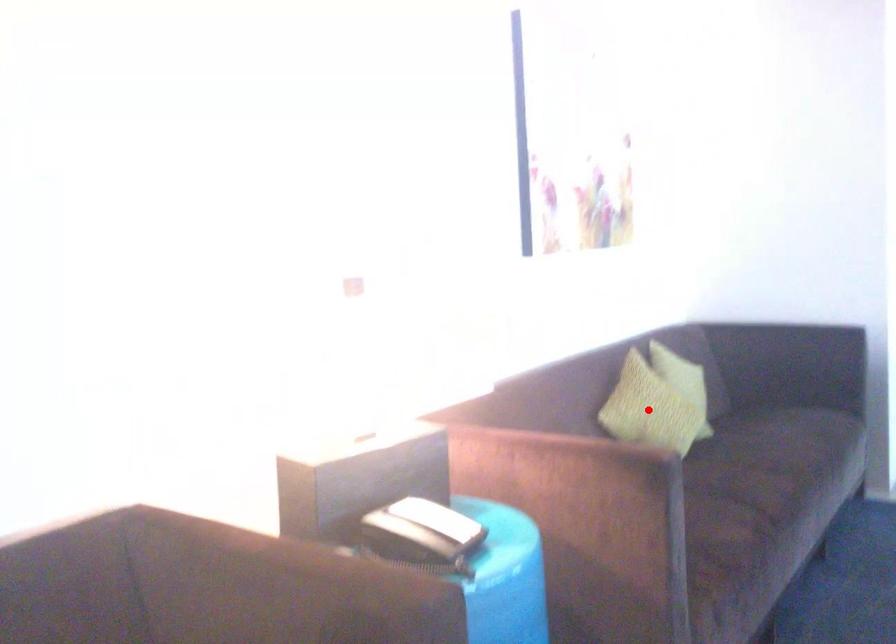
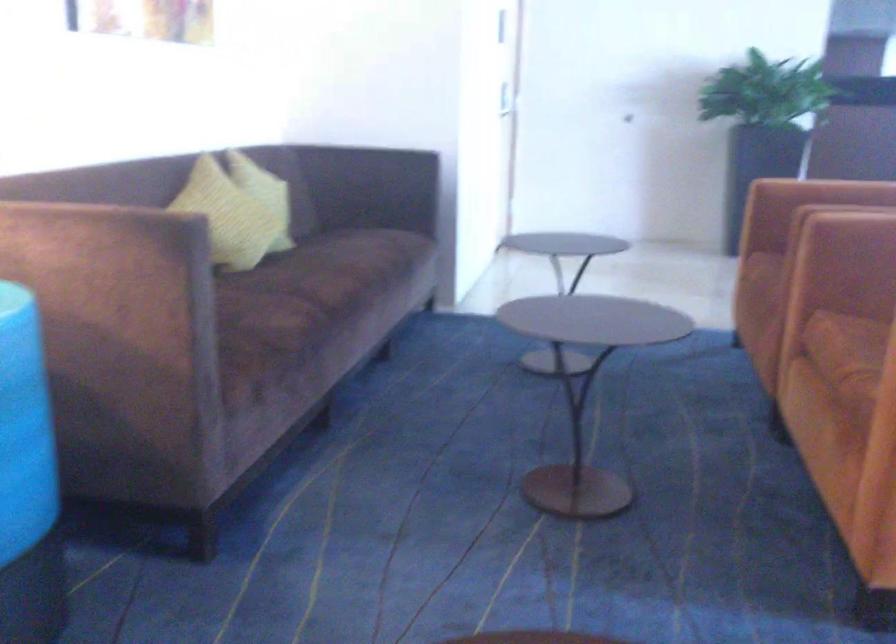
Question: I am providing you with two images of the same scene from different viewpoints. A red point is marked on the first image. Can you still see the location of the red point in image 2?

Choices:
 (A) Yes
 (B) No

Answer: (B)